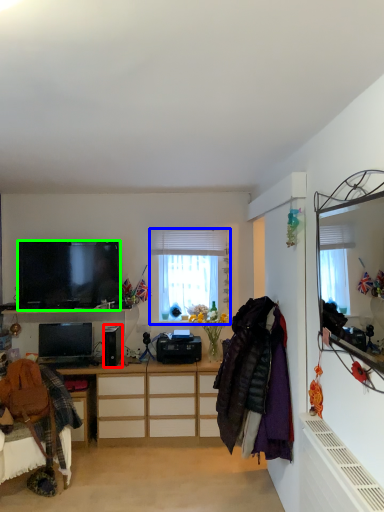
Question: Estimate the real-world distances between objects in this image. Which object is closer to speaker (highlighted by a red box), window (highlighted by a blue box) or television (highlighted by a green box)?

Choices:
 (A) window
 (B) television

Answer: (B)